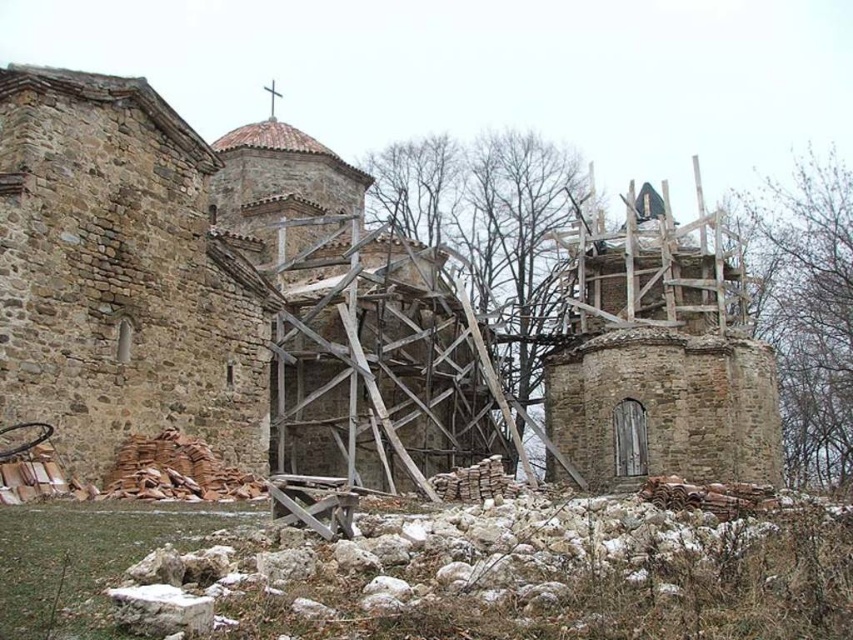
Question: Which object appears closest to the camera in this image?

Choices:
 (A) stone church at center
 (B) stone rubble at right

Answer: (A)

Question: Among these objects, which one is nearest to the camera?

Choices:
 (A) stone church at center
 (B) stone rubble at right

Answer: (A)

Question: Is stone church at center further to camera compared to stone rubble at right?

Choices:
 (A) yes
 (B) no

Answer: (B)

Question: Does stone church at center appear over stone rubble at right?

Choices:
 (A) yes
 (B) no

Answer: (B)

Question: Is stone church at center thinner than stone rubble at right?

Choices:
 (A) no
 (B) yes

Answer: (A)